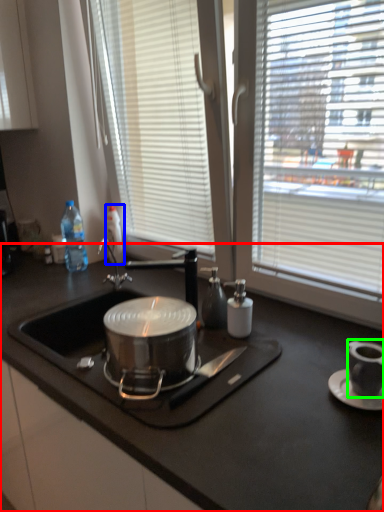
Question: Based on their relative distances, which object is farther from countertop (highlighted by a red box)? Choose from bottle (highlighted by a blue box) and appliance (highlighted by a green box).

Choices:
 (A) bottle
 (B) appliance

Answer: (A)